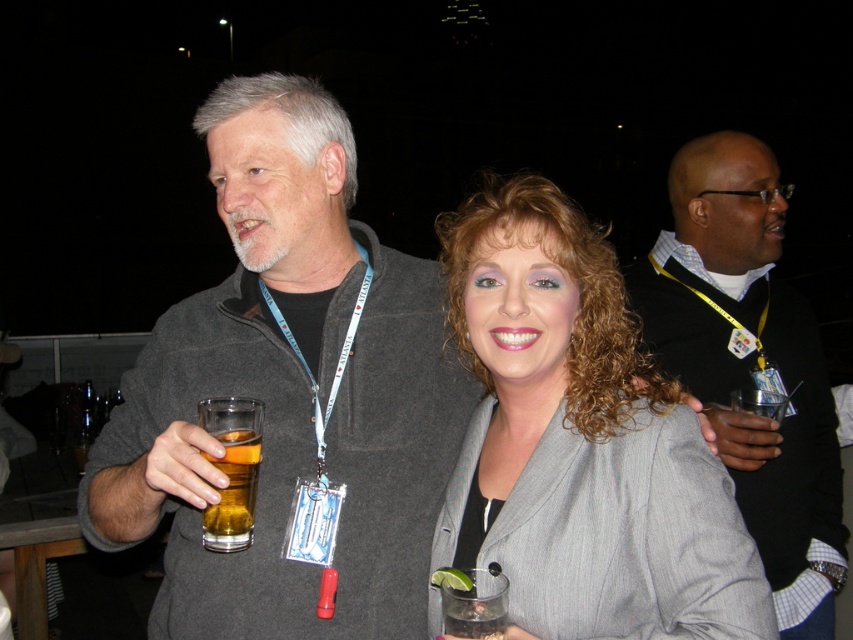
You are at a party and need to decide which clothing item to grab quickly. The gray fabric jacket at center and the black sweater at upper right are both within reach. Which one is positioned higher?

The gray fabric jacket at center is above the black sweater at upper right, so you should grab the gray fabric jacket at center first as it is higher.

You are a photographer standing at the scene. You want to take a closeup photo of the gray fabric jacket at center. The minimum focusing distance of your camera is 1 meter. Can you take the photo without moving the jacket?

The gray fabric jacket at center is 88.36 centimeters away from the viewer, which is less than the camera minimum focusing distance of 1 meter. Therefore, the camera cannot focus on the jacket without moving it closer.